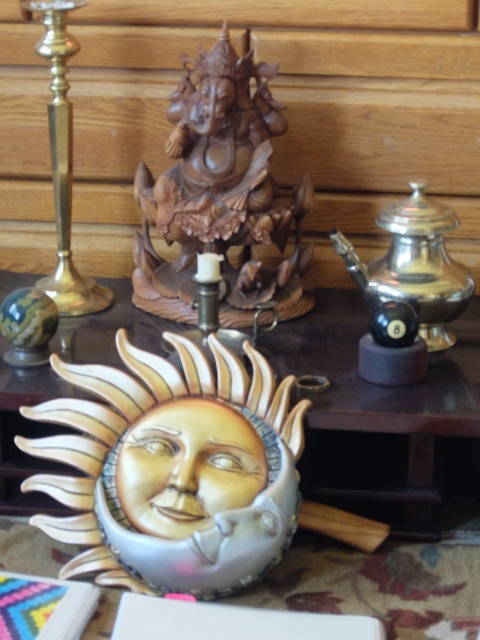
Is porcelain face at center to the right of brass/copper candlestick at left from the viewer's perspective?

Correct, you'll find porcelain face at center to the right of brass/copper candlestick at left.

Does porcelain face at center have a greater height compared to brass/copper candlestick at left?

No.

At what (x,y) coordinates should I click in order to perform the action: click on porcelain face at center. Please return your answer as a coordinate pair (x, y). The width and height of the screenshot is (480, 640). Looking at the image, I should click on (188, 467).

Locate an element on the screen. This screenshot has width=480, height=640. porcelain face at center is located at coordinates (188, 467).

Which is more to the left, wooden statue at center or brass/copper candlestick at left?

brass/copper candlestick at left

What are the coordinates of `wooden statue at center` in the screenshot? It's located at (220, 193).

Locate an element on the screen. The image size is (480, 640). wooden statue at center is located at coordinates (220, 193).

Between point (254, 140) and point (428, 300), which one is positioned behind?

The point (254, 140) is behind.

This screenshot has height=640, width=480. What do you see at coordinates (220, 193) in the screenshot?
I see `wooden statue at center` at bounding box center [220, 193].

Is point (177, 260) more distant than point (377, 218)?

Yes, point (177, 260) is farther from viewer.

Identify the location of wooden statue at center. (220, 193).